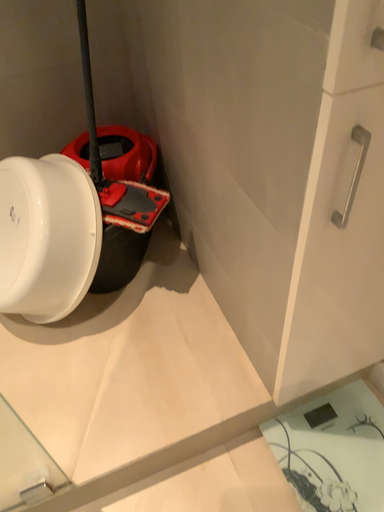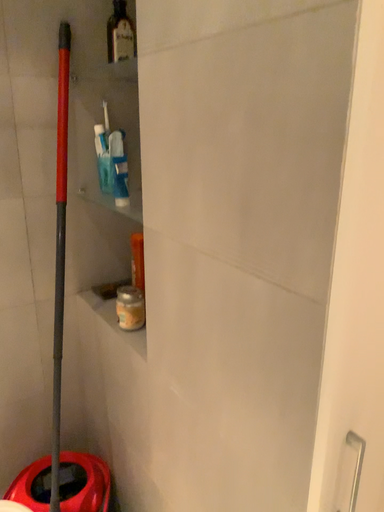
Question: How did the camera likely rotate when shooting the video?

Choices:
 (A) rotated left
 (B) rotated right

Answer: (B)